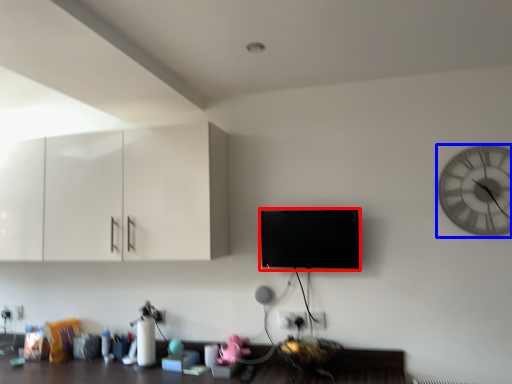
Question: Which of the following is the farthest to the observer, flat (highlighted by a red box) or wall clock (highlighted by a blue box)?

Choices:
 (A) flat
 (B) wall clock

Answer: (A)